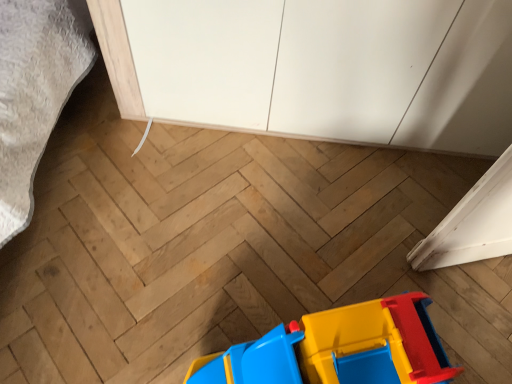
Locate an element on the screen. This screenshot has height=384, width=512. free location above matte plastic toy at lower center (from a real-world perspective) is located at coordinates (361, 348).